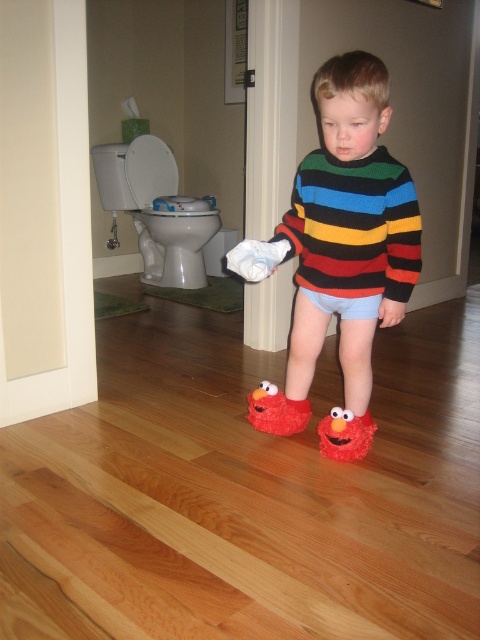
The child is trying to decide which item to put in a small gift box that can only fit items wider than the other. Based on their clothing, which item should they choose, the multicolored knitted sweater at center or the fluffy red elmo slipper at lower center?

The multicolored knitted sweater at center has a larger width than the fluffy red elmo slipper at lower center, so they should choose the multicolored knitted sweater at center since it is wider and the gift box requires items wider than the other.

You are a parent trying to choose between the fluffy red elmo slipper at lower center and the white soft socks at center for your child. Which one is wider?

The fluffy red elmo slipper at lower center is wider than the white soft socks at center.

You are a parent trying to put your child into their fluffy red Elmo slippers. You see the fluffy red elmo slippers at lower center and the fluffy red elmo slipper at lower center. Which one should you put on the left foot?

The fluffy red elmo slippers at lower center is wider than the fluffy red elmo slipper at lower center, so you should put the wider one on the left foot.